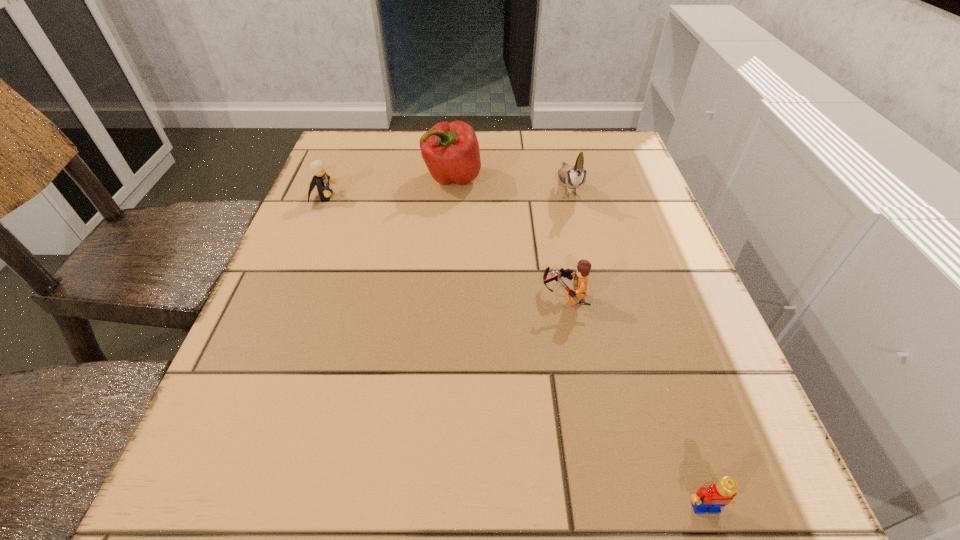
The height and width of the screenshot is (540, 960). I want to click on bell pepper, so tap(450, 150).

This screenshot has height=540, width=960. Find the location of `bird`. bird is located at coordinates (573, 177).

Find the location of a particular element. This screenshot has height=540, width=960. the second nearest object is located at coordinates (580, 281).

Locate an element on the screen. The image size is (960, 540). the second farthest Lego is located at coordinates (580, 281).

Where is `the farthest Lego`? The image size is (960, 540). the farthest Lego is located at coordinates (320, 179).

Identify the location of the leftmost object. This screenshot has height=540, width=960. (320, 179).

The image size is (960, 540). What are the coordinates of `the nearest Lego` in the screenshot? It's located at (711, 499).

Locate an element on the screen. This screenshot has width=960, height=540. the rightmost object is located at coordinates (711, 499).

In order to click on free space located 0.290m on the right of the second object from left to right in this screenshot , I will do `click(604, 178)`.

I want to click on vacant area situated 0.350m at the face of the bird, so click(607, 347).